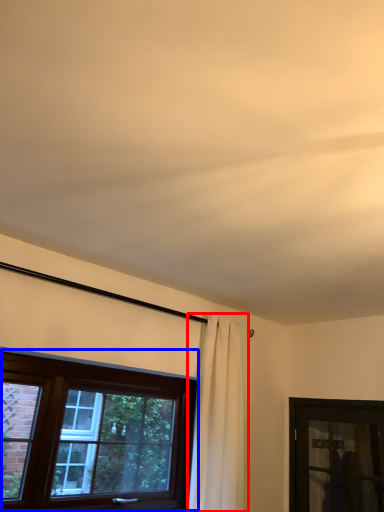
Question: Which object appears closest to the camera in this image, curtain (highlighted by a red box) or window (highlighted by a blue box)?

Choices:
 (A) curtain
 (B) window

Answer: (B)